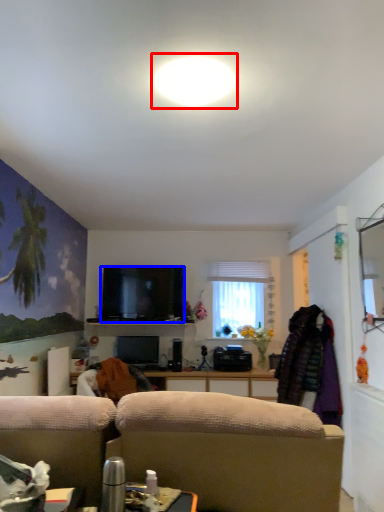
Question: Which object appears closest to the camera in this image, bright (highlighted by a red box) or television (highlighted by a blue box)?

Choices:
 (A) bright
 (B) television

Answer: (A)